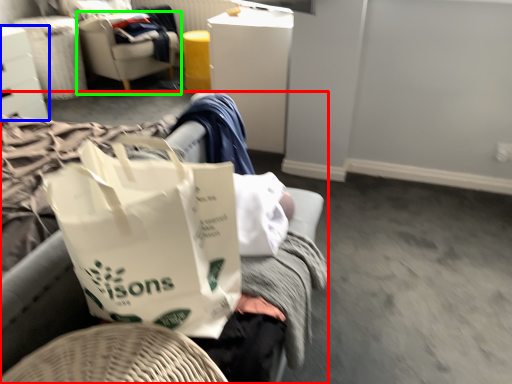
Question: Which is farther away from furniture (highlighted by a red box)? furniture (highlighted by a blue box) or chair (highlighted by a green box)?

Choices:
 (A) furniture
 (B) chair

Answer: (B)